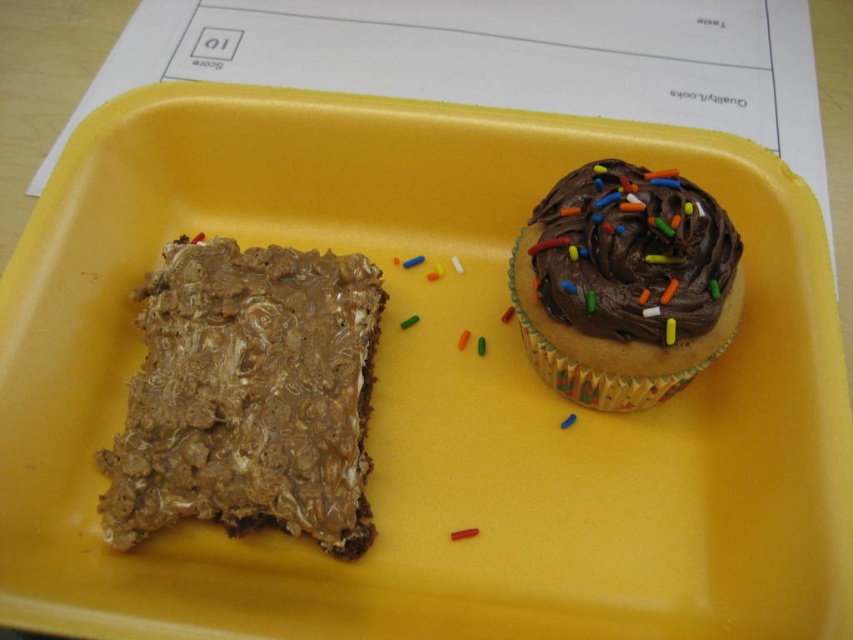
Question: Which object appears farthest from the camera in this image?

Choices:
 (A) chocolatecrumblycake at left
 (B) chocolate frosted cupcake at upper right

Answer: (B)

Question: Where is chocolatecrumblycake at left located in relation to chocolate frosted cupcake at upper right in the image?

Choices:
 (A) left
 (B) right

Answer: (A)

Question: Is the position of chocolatecrumblycake at left more distant than that of chocolate frosted cupcake at upper right?

Choices:
 (A) no
 (B) yes

Answer: (A)

Question: Is chocolatecrumblycake at left to the left of chocolate frosted cupcake at upper right from the viewer's perspective?

Choices:
 (A) yes
 (B) no

Answer: (A)

Question: Which of the following is the farthest from the observer?

Choices:
 (A) (334, 422)
 (B) (683, 346)

Answer: (A)